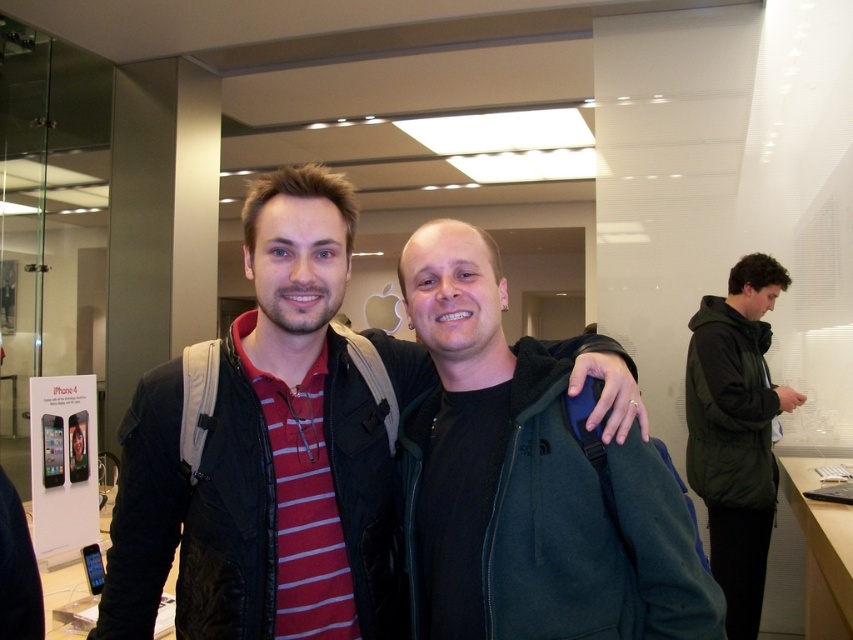
You are trying to decide between two jackets displayed in an Apple Store. You see the green fleece jacket at center and the green matte jacket at right. Which one is narrower in width?

The green fleece jacket at center is narrower in width than the green matte jacket at right.